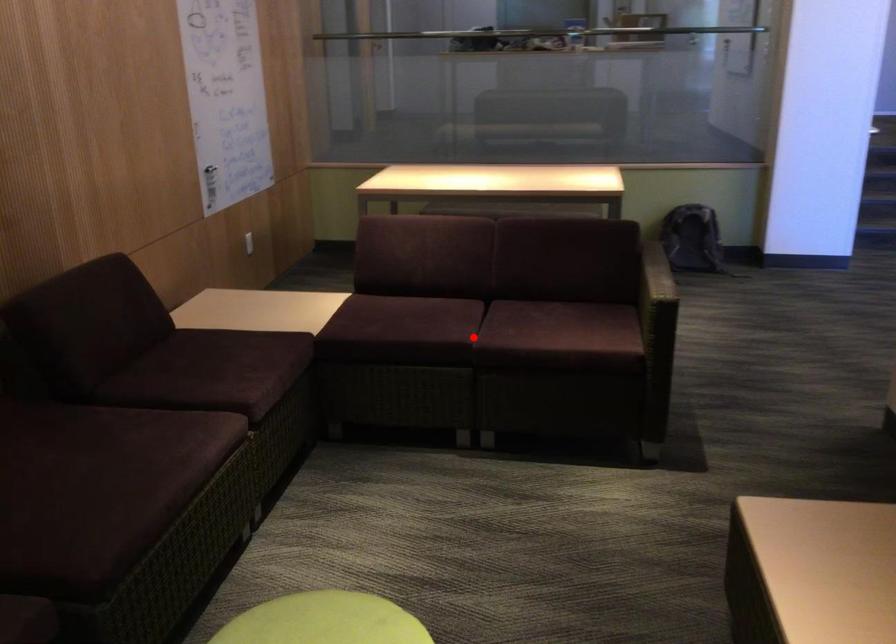
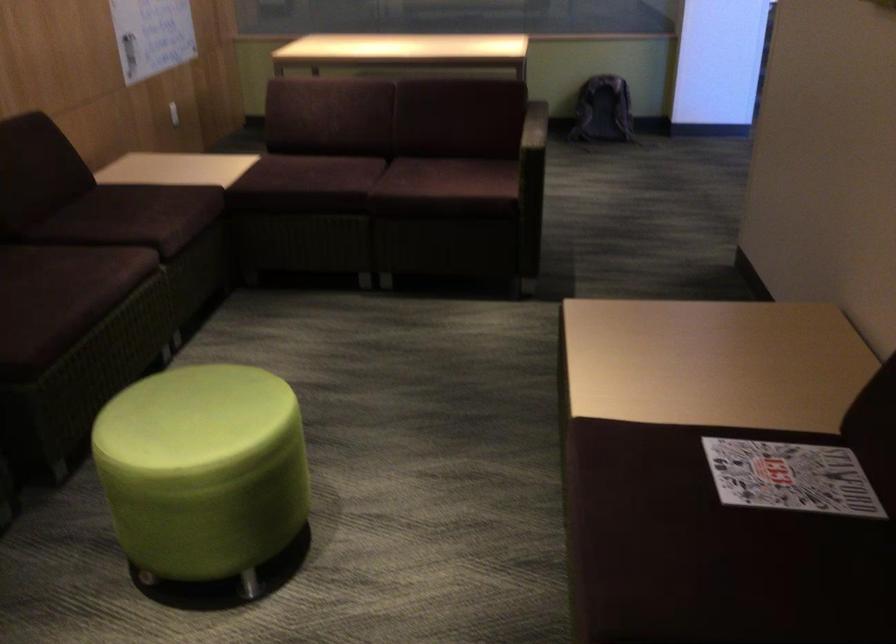
Question: I am providing you with two images of the same scene from different viewpoints. A red point is marked on the first image. Is the red point's position out of view in image 2?

Choices:
 (A) Yes
 (B) No

Answer: (B)